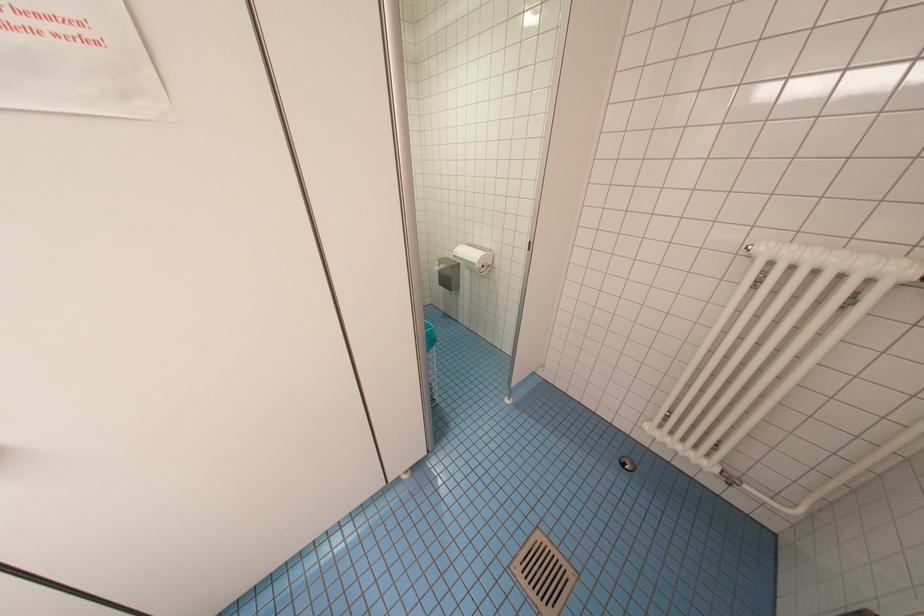
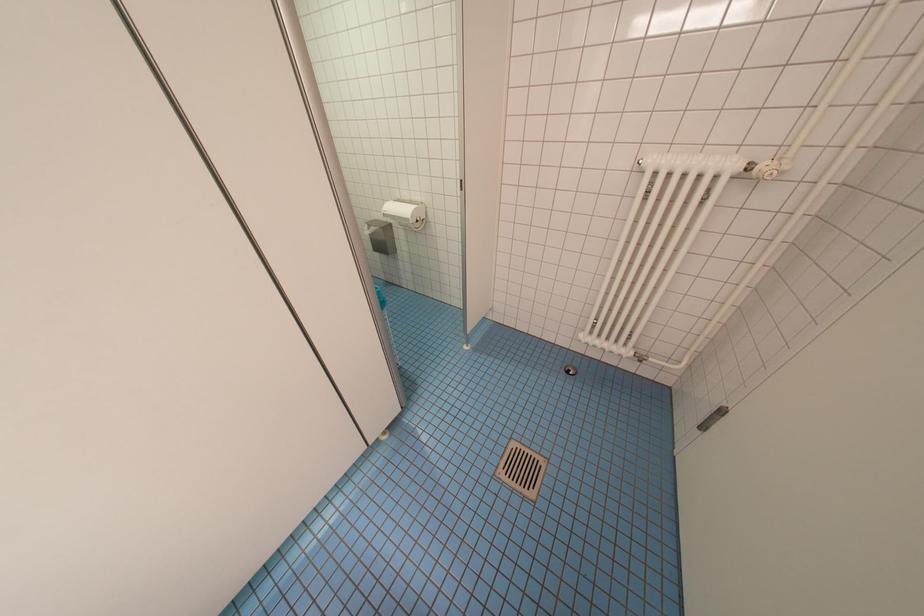
Question: Which direction would the cameraman need to move to produce the second image? Reply with the corresponding letter.

Choices:
 (A) Left
 (B) Right
 (C) Forward
 (D) Backward

Answer: (A)